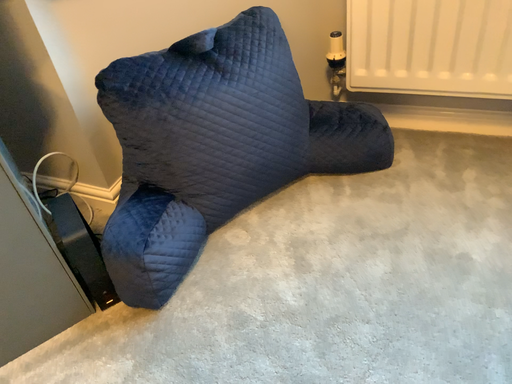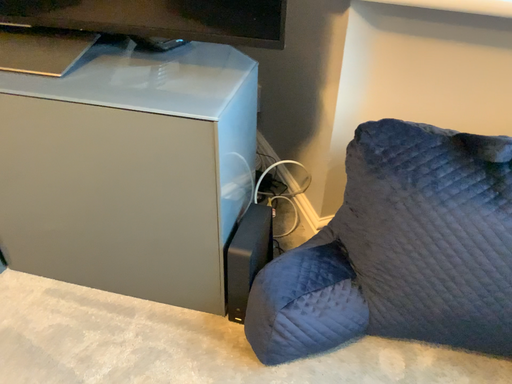
Question: Which way did the camera rotate in the video?

Choices:
 (A) rotated left
 (B) rotated right

Answer: (A)